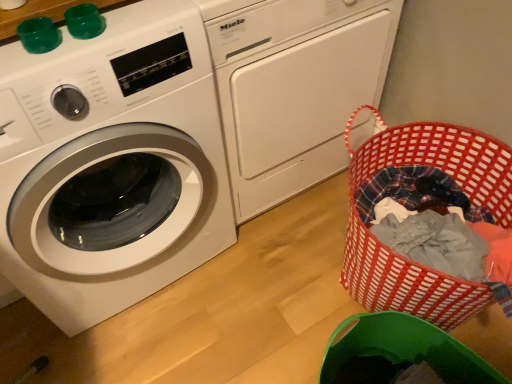
Locate an element on the screen. vacant space to the left of red woven laundry basket at lower right is located at coordinates (280, 274).